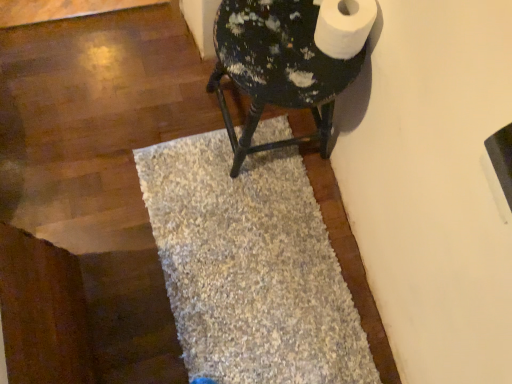
Question: From a real-world perspective, is white matte toilet paper at upper right located higher than painted wood stool at upper right?

Choices:
 (A) yes
 (B) no

Answer: (A)

Question: From a real-world perspective, is white matte toilet paper at upper right below painted wood stool at upper right?

Choices:
 (A) yes
 (B) no

Answer: (B)

Question: Can you confirm if white matte toilet paper at upper right is taller than painted wood stool at upper right?

Choices:
 (A) yes
 (B) no

Answer: (B)

Question: Is white matte toilet paper at upper right completely or partially outside of painted wood stool at upper right?

Choices:
 (A) no
 (B) yes

Answer: (B)

Question: Is white matte toilet paper at upper right not near painted wood stool at upper right?

Choices:
 (A) no
 (B) yes

Answer: (A)

Question: Does white matte toilet paper at upper right appear on the left side of painted wood stool at upper right?

Choices:
 (A) no
 (B) yes

Answer: (A)

Question: Is the position of painted wood stool at upper right more distant than that of beige shaggy bath mat at center?

Choices:
 (A) yes
 (B) no

Answer: (B)

Question: Considering the relative positions of painted wood stool at upper right and beige shaggy bath mat at center in the image provided, is painted wood stool at upper right to the right of beige shaggy bath mat at center from the viewer's perspective?

Choices:
 (A) no
 (B) yes

Answer: (B)

Question: From the image's perspective, does painted wood stool at upper right appear higher than beige shaggy bath mat at center?

Choices:
 (A) yes
 (B) no

Answer: (A)

Question: Is painted wood stool at upper right at the left side of beige shaggy bath mat at center?

Choices:
 (A) no
 (B) yes

Answer: (A)

Question: Is painted wood stool at upper right not close to beige shaggy bath mat at center?

Choices:
 (A) yes
 (B) no

Answer: (B)

Question: Is beige shaggy bath mat at center located within painted wood stool at upper right?

Choices:
 (A) no
 (B) yes

Answer: (A)

Question: Is beige shaggy bath mat at center oriented towards painted wood stool at upper right?

Choices:
 (A) yes
 (B) no

Answer: (B)